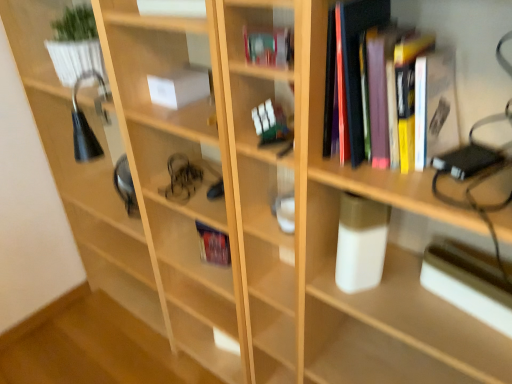
Question: Can you confirm if white glossy glass at center, placed as the first shelf when sorted from right to left, is smaller than white glossy book at upper center, the third book from the front?

Choices:
 (A) yes
 (B) no

Answer: (A)

Question: From the image's perspective, would you say white glossy glass at center, acting as the 1th shelf starting from the bottom, is shown under white glossy book at upper center, positioned as the 3th book in back-to-front order?

Choices:
 (A) yes
 (B) no

Answer: (A)

Question: Could you tell me if white glossy glass at center, placed as the first shelf when sorted from right to left, is facing white glossy book at upper center, the third book from the front?

Choices:
 (A) yes
 (B) no

Answer: (B)

Question: Considering the relative sizes of white glossy glass at center, which appears as the first shelf when viewed from the front, and white glossy book at upper center, the third book from the front, in the image provided, is white glossy glass at center, which appears as the first shelf when viewed from the front, shorter than white glossy book at upper center, the third book from the front,?

Choices:
 (A) yes
 (B) no

Answer: (B)

Question: Is white glossy glass at center, which is the 2th shelf in top-to-bottom order, to the left of white glossy book at upper center, positioned as the 3th book in back-to-front order, from the viewer's perspective?

Choices:
 (A) yes
 (B) no

Answer: (B)

Question: Considering the positions of white glossy glass at center, which is the second shelf in left-to-right order, and white paper at center, the 4th book when ordered from front to back, in the image, is white glossy glass at center, which is the second shelf in left-to-right order, taller or shorter than white paper at center, the 4th book when ordered from front to back,?

Choices:
 (A) tall
 (B) short

Answer: (A)

Question: Is white glossy glass at center, which is the 2th shelf in top-to-bottom order, inside the boundaries of white paper at center, acting as the 2th book starting from the back, or outside?

Choices:
 (A) outside
 (B) inside

Answer: (A)

Question: Considering the positions of point (234, 109) and point (173, 92), is point (234, 109) closer or farther from the camera than point (173, 92)?

Choices:
 (A) farther
 (B) closer

Answer: (B)

Question: From the image's perspective, relative to white paper at center, the 4th book when ordered from front to back, is white glossy glass at center, arranged as the 2th shelf when viewed from the back, above or below?

Choices:
 (A) below
 (B) above

Answer: (A)

Question: Is white paper at center, the 4th book when ordered from front to back, taller or shorter than white glossy book at upper center, the third book from the front?

Choices:
 (A) short
 (B) tall

Answer: (B)

Question: Choose the correct answer: Is white paper at center, acting as the 2th book starting from the back, inside white glossy book at upper center, the third book from the front, or outside it?

Choices:
 (A) outside
 (B) inside

Answer: (A)

Question: In the image, is white paper at center, acting as the 2th book starting from the back, positioned in front of or behind white glossy book at upper center, the third book from the front?

Choices:
 (A) behind
 (B) front

Answer: (A)

Question: Looking at their shapes, would you say white paper at center, the 4th book when ordered from front to back, is wider or thinner than white glossy book at upper center, positioned as the 3th book in back-to-front order?

Choices:
 (A) thin
 (B) wide

Answer: (B)

Question: Would you say white glossy plant pot at upper left, acting as the 2th shelf starting from the front, is to the left or to the right of hardcover book at center, the first book when ordered from back to front, in the picture?

Choices:
 (A) left
 (B) right

Answer: (A)

Question: Relative to hardcover book at center, the first book when ordered from back to front, is white glossy plant pot at upper left, the second shelf in the bottom-to-top sequence, in front or behind?

Choices:
 (A) behind
 (B) front

Answer: (B)